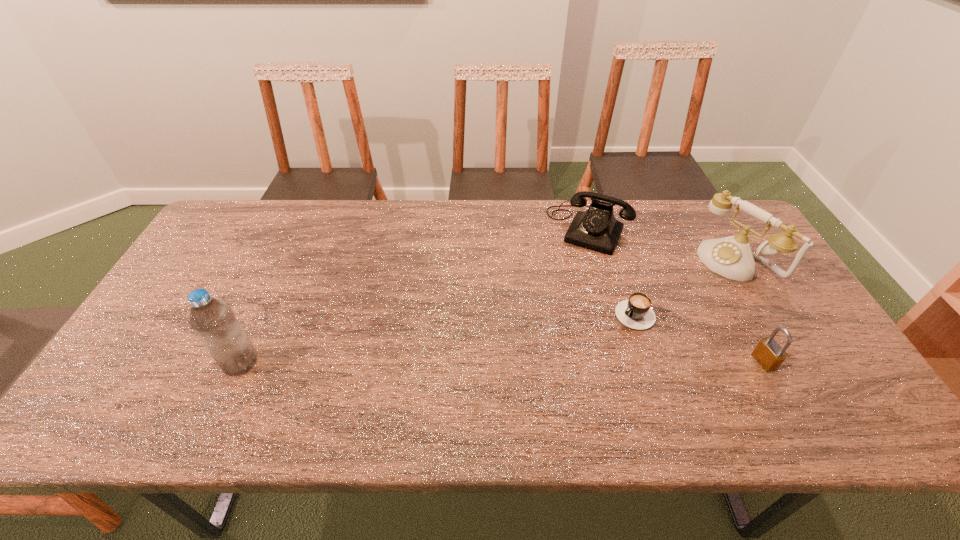
The width and height of the screenshot is (960, 540). I want to click on vacant area that lies between the fourth shortest object and the shortest object, so click(689, 288).

Select which object appears as the second closest to the left telephone. Please provide its 2D coordinates. Your answer should be formatted as a tuple, i.e. [(x, y)], where the tuple contains the x and y coordinates of a point satisfying the conditions above.

[(636, 313)]

This screenshot has width=960, height=540. In order to click on object that stands as the second closest to the left telephone in this screenshot , I will do `click(636, 313)`.

The height and width of the screenshot is (540, 960). Identify the location of free region that satisfies the following two spatial constraints: 1. on the front side of the shorter telephone; 2. on the left side of the padlock. (626, 361).